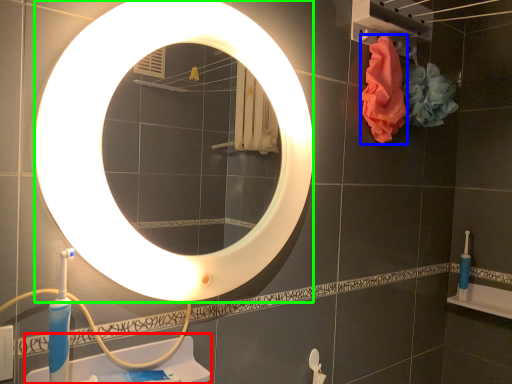
Question: Which object is positioned farthest from sink (highlighted by a red box)? Select from material (highlighted by a blue box) and mirror (highlighted by a green box).

Choices:
 (A) material
 (B) mirror

Answer: (A)